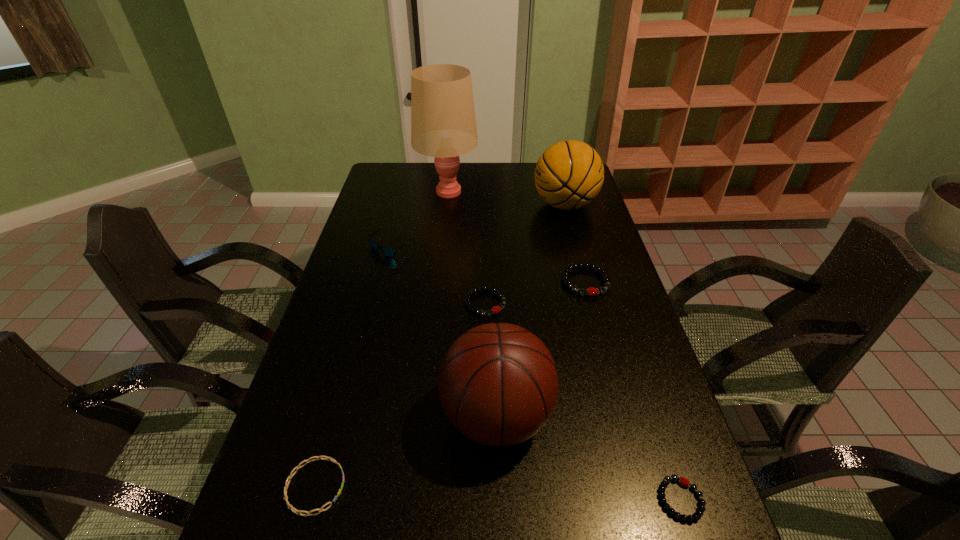
Where is `vacant space located on the left of the tallest bracelet`? The image size is (960, 540). vacant space located on the left of the tallest bracelet is located at coordinates (488, 282).

The height and width of the screenshot is (540, 960). Find the location of `vacant space located on the back of the third shortest object`. vacant space located on the back of the third shortest object is located at coordinates (485, 255).

Find the location of a particular element. The width and height of the screenshot is (960, 540). blank area located on the surface of the leftmost bracelet showing star-shaped elements is located at coordinates (388, 487).

Where is `vacant space located on the back of the smallest black bracelet`? vacant space located on the back of the smallest black bracelet is located at coordinates (631, 349).

Where is `lampshade that is at the far edge`? This screenshot has width=960, height=540. lampshade that is at the far edge is located at coordinates (443, 125).

Image resolution: width=960 pixels, height=540 pixels. Identify the location of basketball that is at the far edge. (569, 174).

At what (x,y) coordinates should I click in order to perform the action: click on sunglasses positioned at the left edge. Please return your answer as a coordinate pair (x, y). This screenshot has width=960, height=540. Looking at the image, I should click on (387, 251).

Identify the location of bracelet that is positioned at the left edge. (291, 475).

Image resolution: width=960 pixels, height=540 pixels. Identify the location of basketball at the right edge. (x=569, y=174).

This screenshot has width=960, height=540. I want to click on object that is at the far right corner, so click(569, 174).